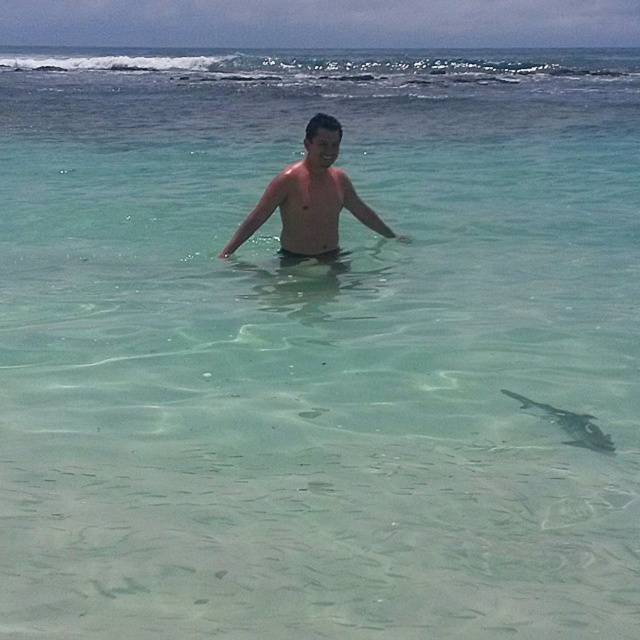
Question: Which object appears closest to the camera in this image?

Choices:
 (A) translucent clear fish at lower right
 (B) smooth skin torso at center

Answer: (A)

Question: Estimate the real-world distances between objects in this image. Which object is farther from the translucent clear fish at lower right?

Choices:
 (A) shiny skin at center
 (B) smooth skin torso at center

Answer: (A)

Question: Based on their relative distances, which object is farther from the shiny skin at center?

Choices:
 (A) translucent clear fish at lower right
 (B) smooth skin torso at center

Answer: (A)

Question: Does smooth skin torso at center have a greater width compared to translucent clear fish at lower right?

Choices:
 (A) yes
 (B) no

Answer: (A)

Question: Is shiny skin at center to the right of translucent clear fish at lower right from the viewer's perspective?

Choices:
 (A) yes
 (B) no

Answer: (B)

Question: Is shiny skin at center bigger than smooth skin torso at center?

Choices:
 (A) no
 (B) yes

Answer: (B)